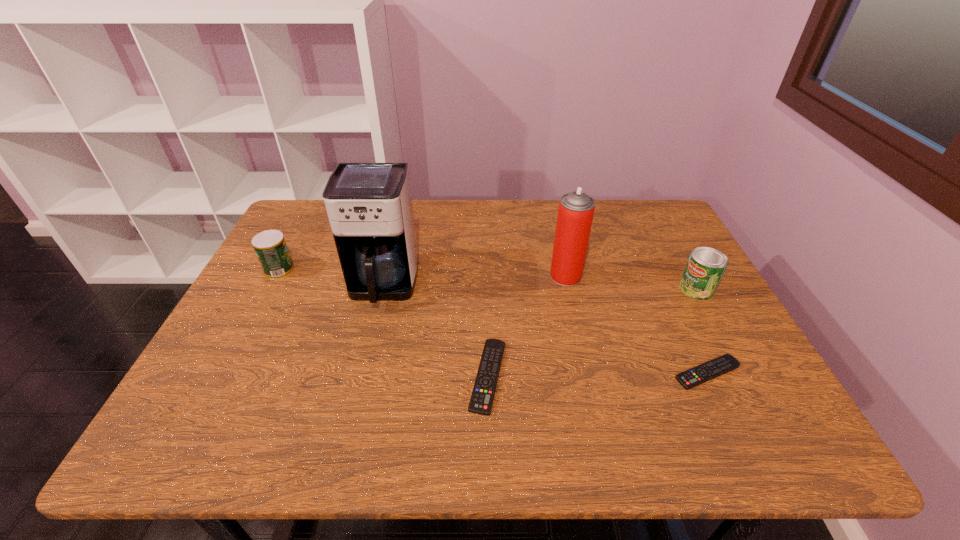
Identify the location of free space located on the left of the right remote control. The image size is (960, 540). (552, 373).

Where is `vacant space located on the front panel of the coffee maker`? The height and width of the screenshot is (540, 960). vacant space located on the front panel of the coffee maker is located at coordinates (354, 401).

Locate an element on the screen. The image size is (960, 540). free space located on the front of the second tallest object is located at coordinates (581, 343).

At what (x,y) coordinates should I click in order to perform the action: click on blank area located 0.200m on the front of the right can. Please return your answer as a coordinate pair (x, y). Image resolution: width=960 pixels, height=540 pixels. Looking at the image, I should click on click(735, 360).

Identify the location of vacant area situated on the front of the left can. (251, 325).

Locate an element on the screen. object that is at the left edge is located at coordinates (271, 249).

This screenshot has width=960, height=540. I want to click on remote control located in the right edge section of the desktop, so click(707, 371).

Identify the location of can positioned at the right edge. Image resolution: width=960 pixels, height=540 pixels. (706, 266).

This screenshot has height=540, width=960. Find the location of `object that is at the near right corner`. object that is at the near right corner is located at coordinates (707, 371).

The height and width of the screenshot is (540, 960). I want to click on vacant space at the far edge of the desktop, so click(454, 232).